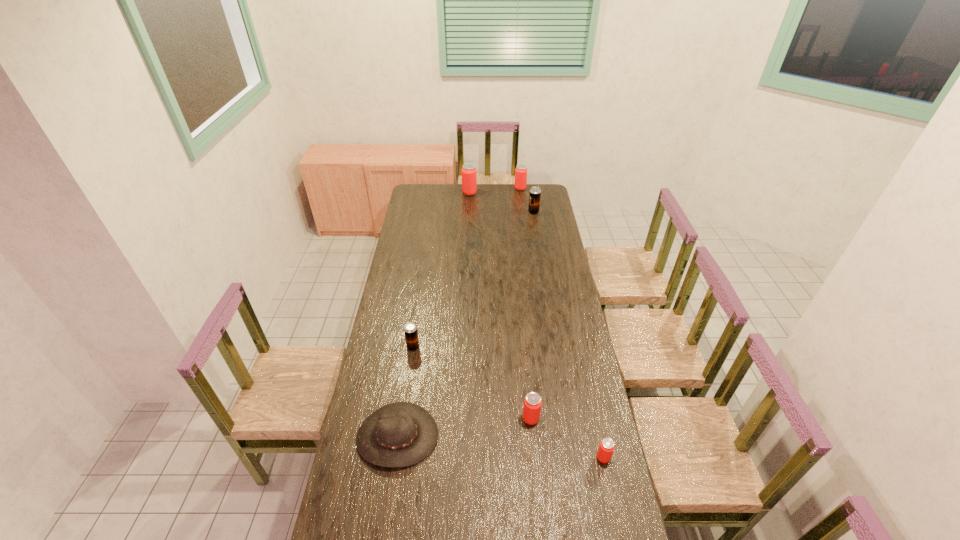
Where is `hat at the left edge`? hat at the left edge is located at coordinates (401, 434).

Identify the location of object located at the far right corner. Image resolution: width=960 pixels, height=540 pixels. (521, 170).

Locate an element on the screen. This screenshot has height=540, width=960. vacant region at the left edge of the desktop is located at coordinates (362, 403).

In the image, there is a desktop. Where is `vacant space at the right edge`? Image resolution: width=960 pixels, height=540 pixels. vacant space at the right edge is located at coordinates pos(554,241).

This screenshot has width=960, height=540. In the image, there is a desktop. In order to click on vacant space at the far right corner in this screenshot , I will do `click(547, 196)`.

Image resolution: width=960 pixels, height=540 pixels. Identify the location of vacant space that's between the gray hat and the third farthest object. (466, 324).

Where is `blank region between the second beer can from left to right and the hat`? The height and width of the screenshot is (540, 960). blank region between the second beer can from left to right and the hat is located at coordinates (434, 315).

You are a GUI agent. You are given a task and a screenshot of the screen. Output one action in this format:
    pyautogui.click(x=<x>, y=<y>)
    Task: Click on the free space between the fifth object from right to left and the fourth object from left to right
    
    Given the screenshot: What is the action you would take?
    pyautogui.click(x=500, y=306)

This screenshot has width=960, height=540. I want to click on empty space between the leftmost red beer can and the fourth farthest object, so click(442, 270).

Where is `empty location between the gray hat and the nearest red beer can`? This screenshot has height=540, width=960. empty location between the gray hat and the nearest red beer can is located at coordinates (500, 447).